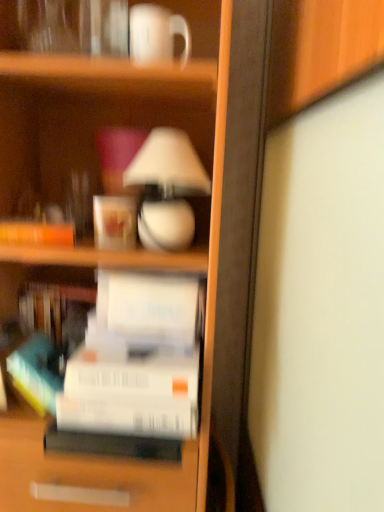
Question: Is white glossy mug at upper center, which is the 2th coffee cup in left-to-right order, wider or thinner than white matte paper at center, the 2th paperback book in the bottom-to-top sequence?

Choices:
 (A) thin
 (B) wide

Answer: (A)

Question: Which is correct: white glossy mug at upper center, which is the 2th coffee cup in left-to-right order, is inside white matte paper at center, which appears as the first paperback book when viewed from the top, or outside of it?

Choices:
 (A) inside
 (B) outside

Answer: (B)

Question: Estimate the real-world distances between objects in this image. Which object is closer to the white glossy mug at upper center, which is the second coffee cup from back to front?

Choices:
 (A) matte white coffee cup at upper center, which is the first coffee cup from left to right
 (B) white glossy lamp at upper center
 (C) white matte paper at center, which appears as the first paperback book when viewed from the top
 (D) white matte paperback book at center, the first paperback book in the bottom-to-top sequence

Answer: (B)

Question: Which of these objects is positioned farthest from the matte white coffee cup at upper center, the 2th coffee cup when ordered from top to bottom?

Choices:
 (A) white matte paperback book at center, the first paperback book in the bottom-to-top sequence
 (B) white matte paper at center, the 2th paperback book in the bottom-to-top sequence
 (C) white glossy mug at upper center, which is counted as the first coffee cup, starting from the top
 (D) white glossy lamp at upper center

Answer: (C)